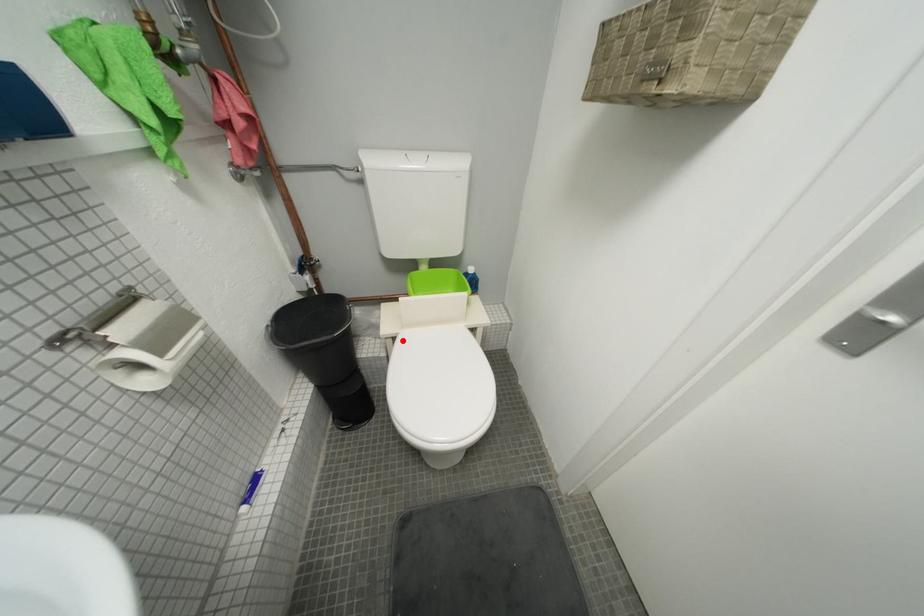
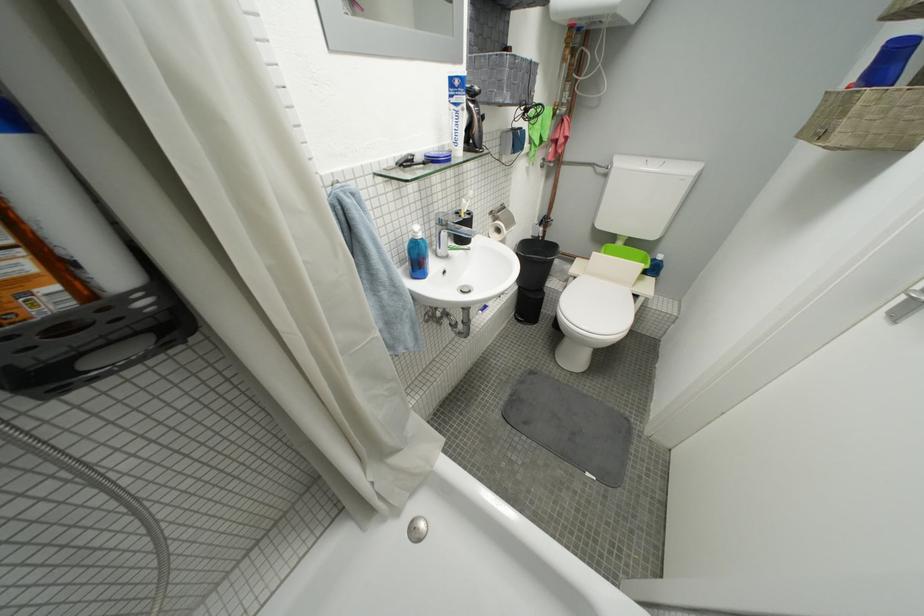
In the second image, find the point that corresponds to the highlighted location in the first image.

(584, 281)